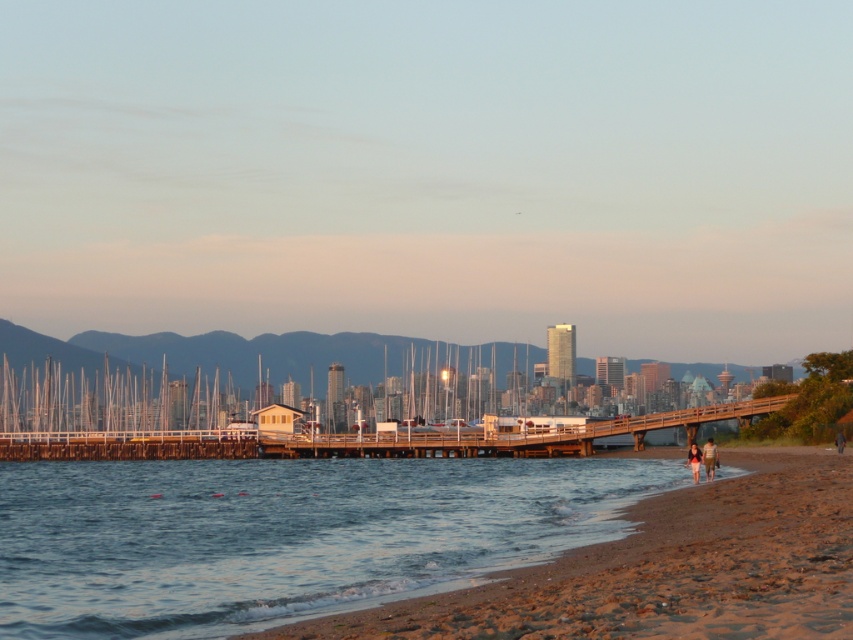
Between light brown sand at lower right and dark blue jeans at lower right, which one has more height?

light brown sand at lower right is taller.

This screenshot has height=640, width=853. In order to click on light brown sand at lower right in this screenshot , I will do `click(709, 458)`.

Find the location of `light brown hair at lower right`. light brown hair at lower right is located at coordinates (694, 460).

Does brown wooden dock at center have a lesser width compared to dark blue jeans at lower right?

Incorrect, brown wooden dock at center's width is not less than dark blue jeans at lower right's.

Which is below, brown wooden dock at center or dark blue jeans at lower right?

Positioned lower is brown wooden dock at center.

Who is more distant from viewer, (x=16, y=451) or (x=837, y=451)?

Positioned behind is point (x=16, y=451).

This screenshot has height=640, width=853. Find the location of `brown wooden dock at center`. brown wooden dock at center is located at coordinates (364, 438).